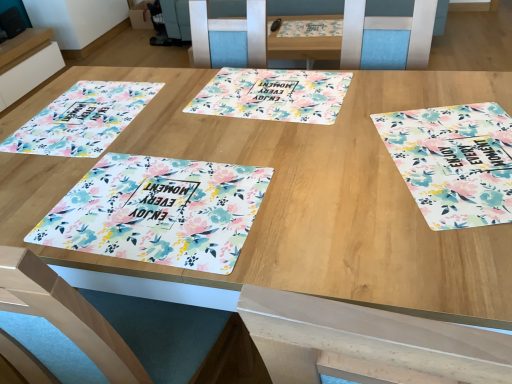
Image resolution: width=512 pixels, height=384 pixels. What are the coordinates of `vacant space in between floral fabric placemat at right, acting as the first tablecloth starting from the right, and floral printed placemat at lower left, the 2th tablecloth when ordered from left to right` in the screenshot? It's located at click(x=311, y=184).